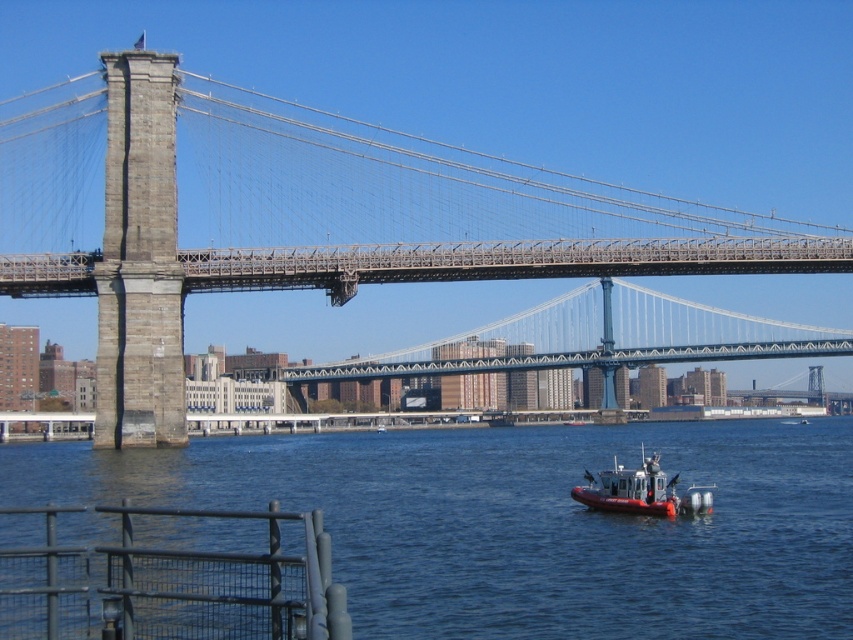
Describe the element at coordinates (320, 269) in the screenshot. The height and width of the screenshot is (640, 853). I see `stone bridge at center` at that location.

Is point (817, 241) farther from camera compared to point (697, 488)?

Yes, it is.

Is point (699, 250) closer to viewer compared to point (643, 451)?

No, (699, 250) is further to viewer.

This screenshot has width=853, height=640. Identify the location of stone bridge at center. (320, 269).

Who is lower down, blue water at lower center or red rubber boat at center?

blue water at lower center

Between point (519, 627) and point (703, 486), which one is positioned behind?

Positioned behind is point (703, 486).

Where is `blue water at lower center`? The image size is (853, 640). blue water at lower center is located at coordinates (523, 522).

Can you confirm if blue water at lower center is bigger than stone bridge at center?

No, blue water at lower center is not bigger than stone bridge at center.

Can you confirm if blue water at lower center is positioned above stone bridge at center?

Incorrect, blue water at lower center is not positioned above stone bridge at center.

Is point (628, 609) more distant than point (694, 253)?

No, it is in front of (694, 253).

Identify the location of blue water at lower center. (523, 522).